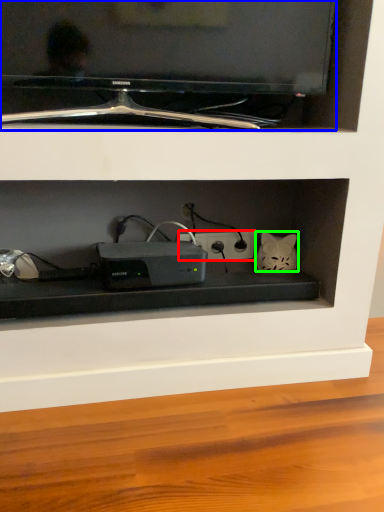
Question: Based on their relative distances, which object is nearer to electric outlet (highlighted by a red box)? Choose from television (highlighted by a blue box) and cat (highlighted by a green box).

Choices:
 (A) television
 (B) cat

Answer: (B)